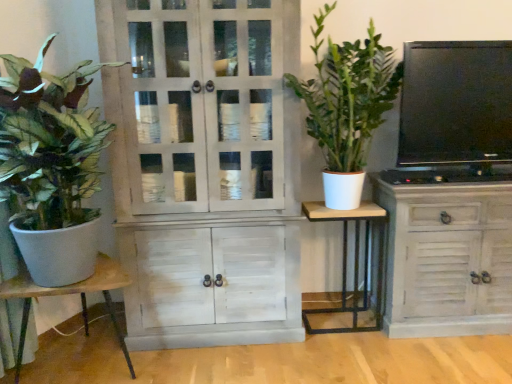
Question: From a real-world perspective, does green matte plant at left, the 1th houseplant from the left, sit lower than wooden table at left, which is counted as the 2th table, starting from the right?

Choices:
 (A) yes
 (B) no

Answer: (B)

Question: From the image's perspective, would you say green matte plant at left, positioned as the second houseplant in right-to-left order, is shown under wooden table at left, which is the first table from left to right?

Choices:
 (A) yes
 (B) no

Answer: (B)

Question: Does green matte plant at left, the 1th houseplant from the left, touch wooden table at left, which is counted as the 2th table, starting from the right?

Choices:
 (A) no
 (B) yes

Answer: (A)

Question: Does green matte plant at left, the 1th houseplant from the left, contain wooden table at left, which is the first table from left to right?

Choices:
 (A) no
 (B) yes

Answer: (A)

Question: From the image's perspective, is green matte plant at left, the 1th houseplant from the left, located above wooden table at left, which is the first table from left to right?

Choices:
 (A) yes
 (B) no

Answer: (A)

Question: Relative to wooden table at left, which is the first table from left to right, is white wood cabinet at center, which appears as the first cabinetry when viewed from the left, in front or behind?

Choices:
 (A) front
 (B) behind

Answer: (B)

Question: Is point (198, 312) closer or farther from the camera than point (117, 329)?

Choices:
 (A) farther
 (B) closer

Answer: (B)

Question: From the image's perspective, is white wood cabinet at center, which appears as the first cabinetry when viewed from the left, located above or below wooden table at left, which is counted as the 2th table, starting from the right?

Choices:
 (A) above
 (B) below

Answer: (A)

Question: Looking at their shapes, would you say white wood cabinet at center, which is counted as the 2th cabinetry, starting from the right, is wider or thinner than wooden table at left, which is counted as the 2th table, starting from the right?

Choices:
 (A) thin
 (B) wide

Answer: (A)

Question: In terms of height, does wooden table at left, which is the first table from left to right, look taller or shorter compared to white wood cabinet at center, which appears as the first cabinetry when viewed from the left?

Choices:
 (A) tall
 (B) short

Answer: (B)

Question: Based on their sizes in the image, would you say wooden table at left, which is counted as the 2th table, starting from the right, is bigger or smaller than white wood cabinet at center, which is counted as the 2th cabinetry, starting from the right?

Choices:
 (A) small
 (B) big

Answer: (A)

Question: Is wooden table at left, which is the first table from left to right, to the left or to the right of white wood cabinet at center, which is counted as the 2th cabinetry, starting from the right, in the image?

Choices:
 (A) left
 (B) right

Answer: (A)

Question: Is wooden table at left, which is counted as the 2th table, starting from the right, inside the boundaries of white wood cabinet at center, which is counted as the 2th cabinetry, starting from the right, or outside?

Choices:
 (A) outside
 (B) inside

Answer: (A)

Question: Looking at the image, does green matte plant at left, positioned as the second houseplant in right-to-left order, seem bigger or smaller compared to distressed white cabinet at right, acting as the first cabinetry starting from the right?

Choices:
 (A) big
 (B) small

Answer: (A)

Question: In terms of height, does green matte plant at left, the 1th houseplant from the left, look taller or shorter compared to distressed white cabinet at right, acting as the first cabinetry starting from the right?

Choices:
 (A) short
 (B) tall

Answer: (B)